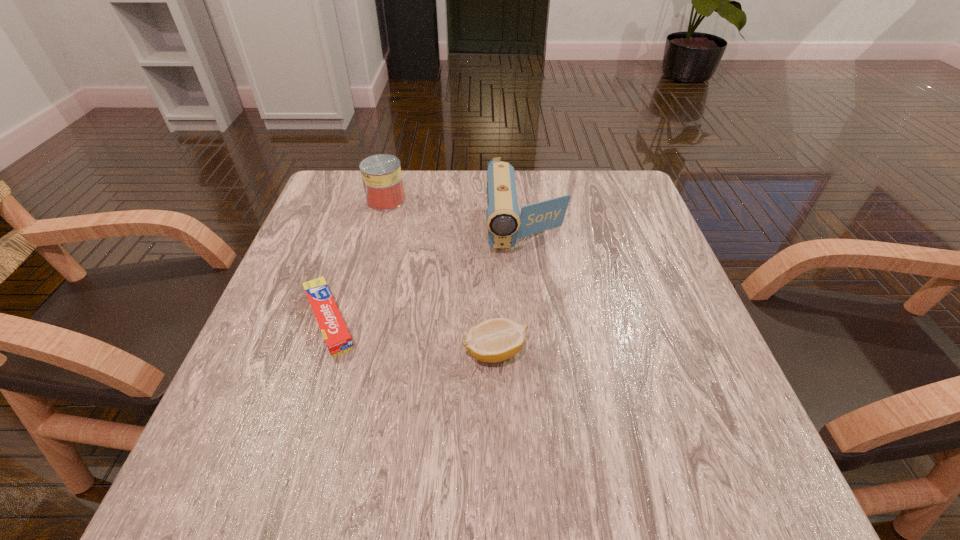
Locate an element on the screen. The height and width of the screenshot is (540, 960). can present at the left edge is located at coordinates (381, 174).

This screenshot has height=540, width=960. Find the location of `toothpaste that is at the left edge`. toothpaste that is at the left edge is located at coordinates click(x=338, y=340).

I want to click on object located in the far left corner section of the desktop, so click(381, 174).

In the image, there is a desktop. Identify the location of vacant space at the far edge. tap(435, 190).

This screenshot has height=540, width=960. In order to click on vacant space at the near edge of the desktop in this screenshot , I will do `click(419, 468)`.

In the image, there is a desktop. What are the coordinates of `vacant space at the left edge` in the screenshot? It's located at (305, 232).

The height and width of the screenshot is (540, 960). What are the coordinates of `vacant space at the right edge` in the screenshot? It's located at (632, 225).

In the image, there is a desktop. Where is `vacant space at the far right corner`? vacant space at the far right corner is located at coordinates (618, 204).

Find the location of a particular element. The height and width of the screenshot is (540, 960). free space between the second tallest object and the lemon is located at coordinates (x=441, y=276).

I want to click on free space that is in between the second shortest object and the tallest object, so click(x=511, y=291).